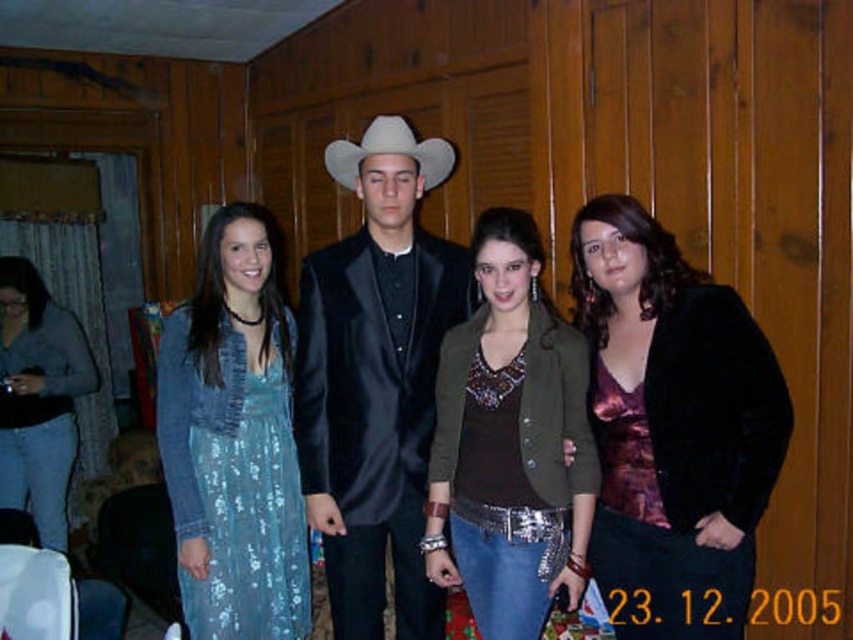
Question: Observing the image, what is the correct spatial positioning of shiny purple blouse at center in reference to matte gray sweater at left?

Choices:
 (A) below
 (B) above

Answer: (B)

Question: Based on their relative distances, which object is nearer to the matte gray sweater at left?

Choices:
 (A) satin black suit at center
 (B) white felt cowboy hat at center
 (C) shiny purple blouse at center
 (D) olive-green textured blazer at center

Answer: (A)

Question: Is matte gray sweater at left below white felt cowboy hat at center?

Choices:
 (A) yes
 (B) no

Answer: (A)

Question: Which is farther from the matte gray sweater at left?

Choices:
 (A) shiny purple blouse at center
 (B) olive-green textured blazer at center
 (C) white felt cowboy hat at center

Answer: (A)

Question: Is olive-green textured blazer at center wider than matte gray sweater at left?

Choices:
 (A) yes
 (B) no

Answer: (A)

Question: Estimate the real-world distances between objects in this image. Which object is closer to the sequined blue dress at left?

Choices:
 (A) white felt cowboy hat at center
 (B) olive-green textured blazer at center

Answer: (B)